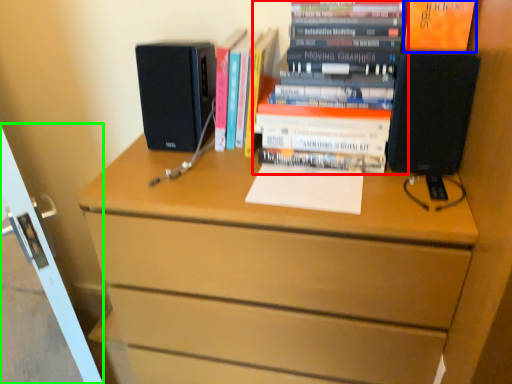
Question: Estimate the real-world distances between objects in this image. Which object is farther from book (highlighted by a red box), paperback book (highlighted by a blue box) or screen door (highlighted by a green box)?

Choices:
 (A) paperback book
 (B) screen door

Answer: (B)